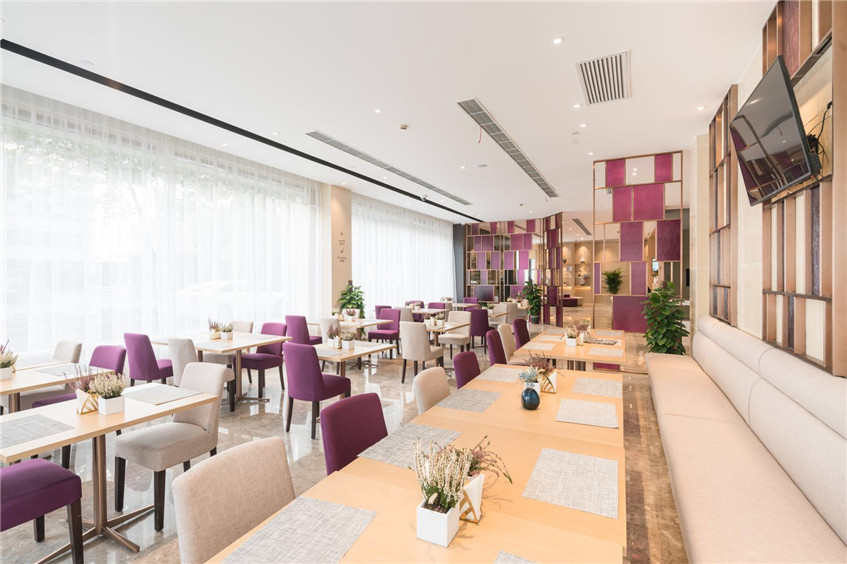
Find the location of a particular element. This screenshot has height=564, width=847. grating on ceiling vents is located at coordinates pos(584,83), pos(590,87), pos(598,96), pos(593,67), pos(600,67), pos(605,68), pos(610,69), pos(615,70), pos(619,70).